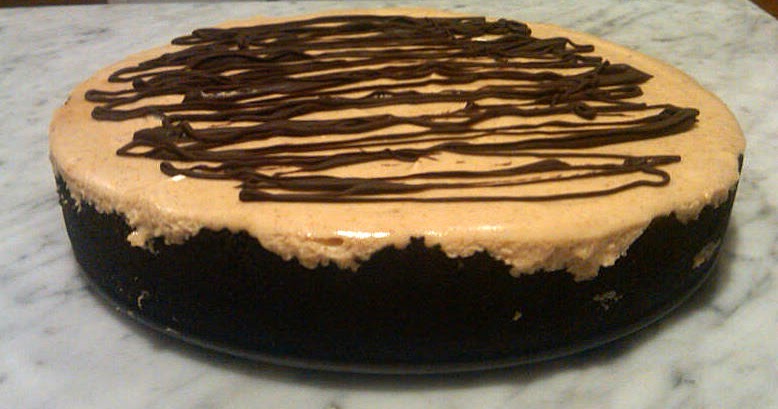
At what (x,y) coordinates should I click in order to perform the action: click on black stripes and swirls in the white marble. Please return your answer as a coordinate pair (x, y). Looking at the image, I should click on (89, 34), (674, 376), (765, 207), (610, 22).